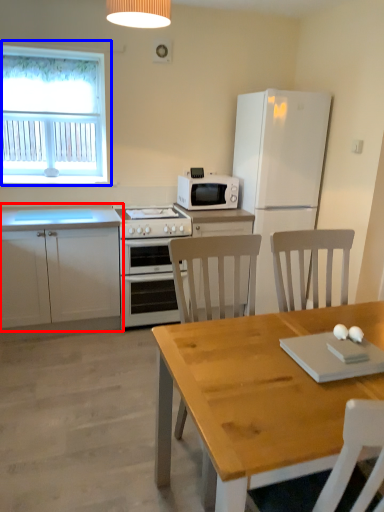
Question: Which point is closer to the camera, cabinetry (highlighted by a red box) or window (highlighted by a blue box)?

Choices:
 (A) cabinetry
 (B) window

Answer: (A)